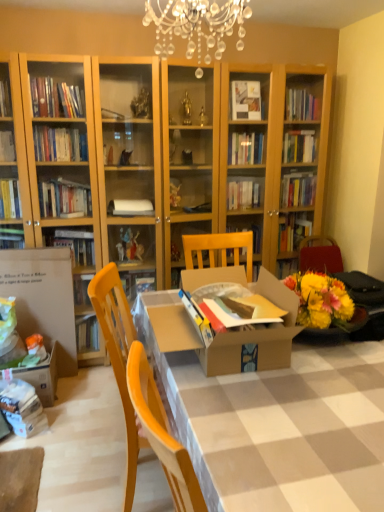
Question: Is wooden chair at center outside white cardboard box at left?

Choices:
 (A) yes
 (B) no

Answer: (A)

Question: Is white cardboard box at left located within wooden chair at center?

Choices:
 (A) yes
 (B) no

Answer: (B)

Question: Does wooden chair at center come in front of white cardboard box at left?

Choices:
 (A) yes
 (B) no

Answer: (A)

Question: Can you confirm if wooden chair at center is bigger than white cardboard box at left?

Choices:
 (A) yes
 (B) no

Answer: (A)

Question: From the image's perspective, is wooden chair at center above white cardboard box at left?

Choices:
 (A) no
 (B) yes

Answer: (A)

Question: In terms of height, does brown cardboard table at center look taller or shorter compared to wooden chair at center?

Choices:
 (A) tall
 (B) short

Answer: (B)

Question: From a real-world perspective, relative to wooden chair at center, is brown cardboard table at center vertically above or below?

Choices:
 (A) above
 (B) below

Answer: (A)

Question: Is brown cardboard table at center bigger or smaller than wooden chair at center?

Choices:
 (A) small
 (B) big

Answer: (A)

Question: Is brown cardboard table at center inside or outside of wooden chair at center?

Choices:
 (A) inside
 (B) outside

Answer: (A)

Question: From the image's perspective, relative to white cardboard box at left, is cardboard box at center above or below?

Choices:
 (A) below
 (B) above

Answer: (A)

Question: Relative to white cardboard box at left, is cardboard box at center in front or behind?

Choices:
 (A) behind
 (B) front

Answer: (B)

Question: In the image, is cardboard box at center on the left side or the right side of white cardboard box at left?

Choices:
 (A) right
 (B) left

Answer: (A)

Question: Is cardboard box at center taller or shorter than white cardboard box at left?

Choices:
 (A) short
 (B) tall

Answer: (A)

Question: Based on their sizes in the image, would you say brown cardboard table at center is bigger or smaller than cardboard box at center?

Choices:
 (A) small
 (B) big

Answer: (A)

Question: Is point (246, 367) closer or farther from the camera than point (316, 446)?

Choices:
 (A) farther
 (B) closer

Answer: (A)